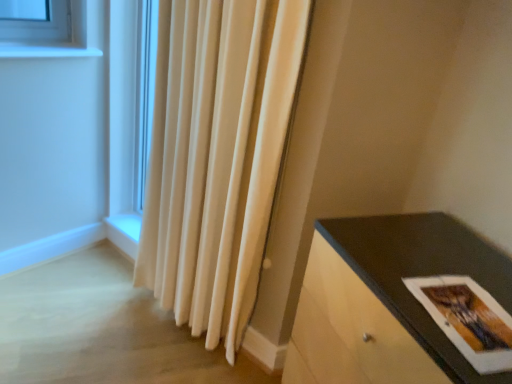
The height and width of the screenshot is (384, 512). Identify the location of vacant space situated on the left part of matte paper postcard at lower right. (387, 289).